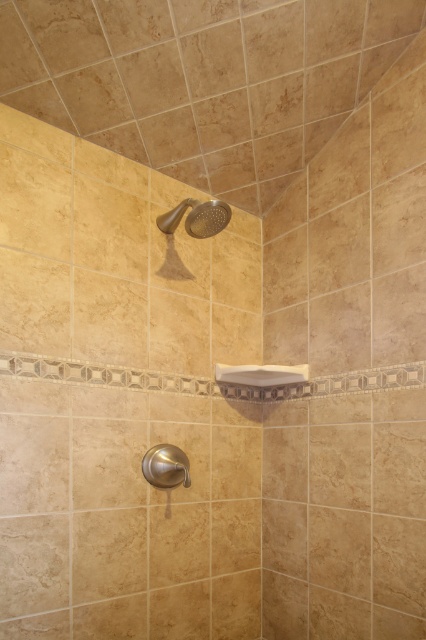
Question: Which of the following is the closest to the observer?

Choices:
 (A) (206, 227)
 (B) (161, 445)

Answer: (B)

Question: Does matte gold showerhead at upper center appear on the right side of brushed metal shower handle at lower center?

Choices:
 (A) no
 (B) yes

Answer: (B)

Question: Is matte gold showerhead at upper center to the left of brushed metal shower handle at lower center from the viewer's perspective?

Choices:
 (A) no
 (B) yes

Answer: (A)

Question: Where is matte gold showerhead at upper center located in relation to brushed metal shower handle at lower center in the image?

Choices:
 (A) left
 (B) right

Answer: (B)